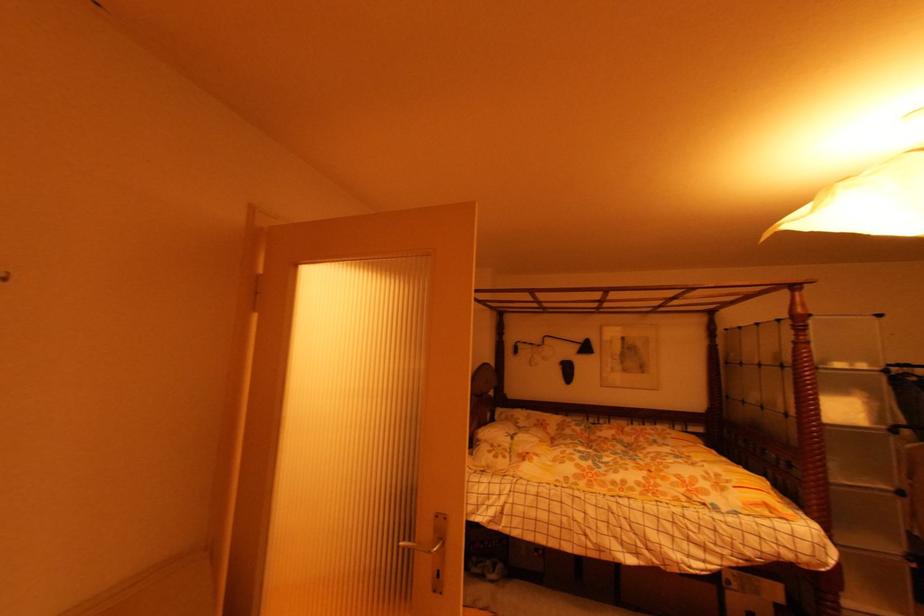
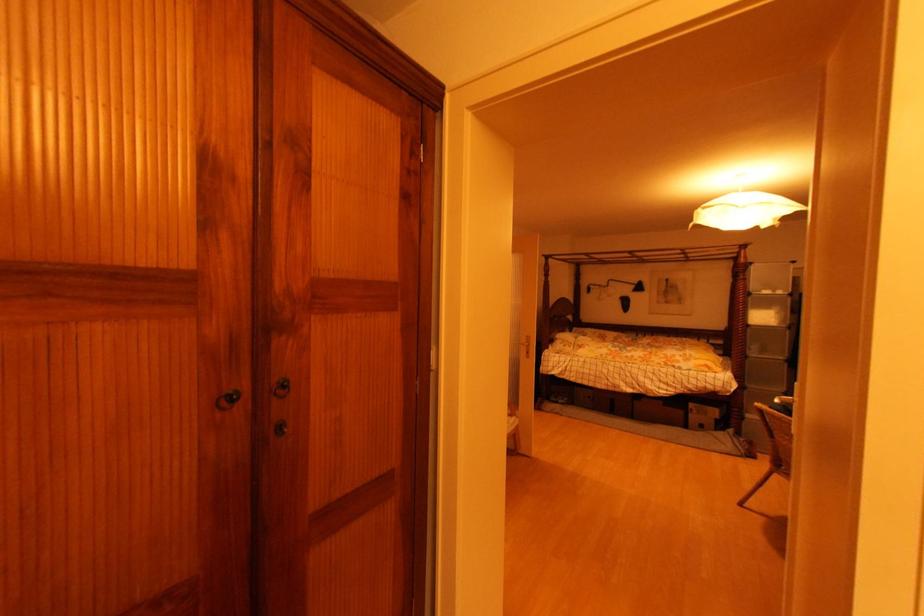
Where in the second image is the point corresponding to (x=580, y=347) from the first image?

(638, 288)